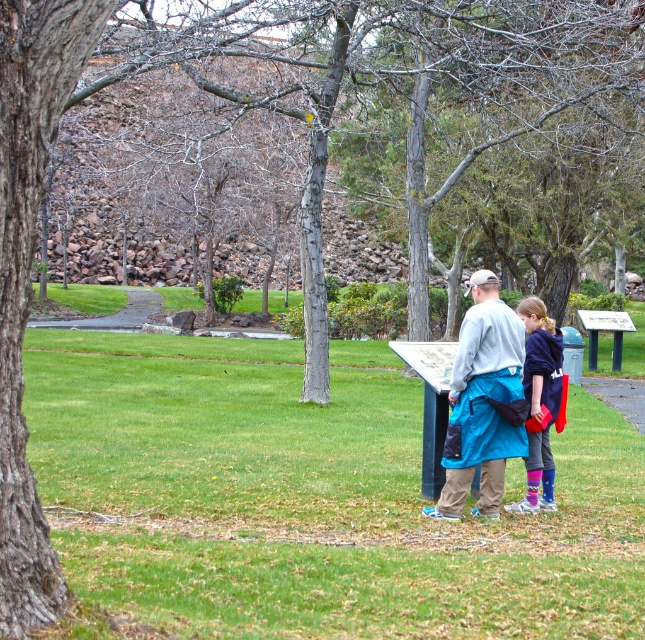
Question: Which object is positioned closest to the blue denim jacket at center?

Choices:
 (A) blue fabric jacket at center
 (B) paved stone path at center

Answer: (A)

Question: Among these objects, which one is farthest from the camera?

Choices:
 (A) paved stone path at center
 (B) blue fabric jacket at center
 (C) blue denim jacket at center

Answer: (A)

Question: Which object is the farthest from the blue denim jacket at center?

Choices:
 (A) blue fabric jacket at center
 (B) paved stone path at center

Answer: (B)

Question: Does blue fabric jacket at center appear over paved stone path at center?

Choices:
 (A) no
 (B) yes

Answer: (A)

Question: Is blue denim jacket at center thinner than paved stone path at center?

Choices:
 (A) no
 (B) yes

Answer: (B)

Question: Is blue fabric jacket at center thinner than paved stone path at center?

Choices:
 (A) no
 (B) yes

Answer: (B)